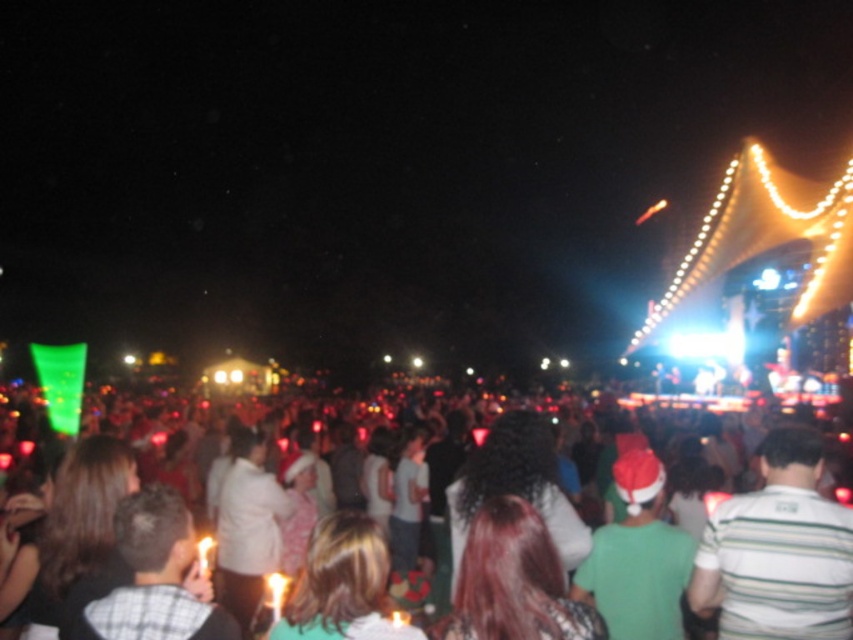
Question: Is white cotton shirt at center further to camera compared to striped cotton shirt at center?

Choices:
 (A) yes
 (B) no

Answer: (A)

Question: Which point is closer to the camera taking this photo?

Choices:
 (A) (440, 401)
 (B) (799, 460)

Answer: (B)

Question: Among these objects, which one is farthest from the camera?

Choices:
 (A) striped cotton shirt at center
 (B) white cotton shirt at center

Answer: (B)

Question: Does white cotton shirt at center appear on the right side of striped cotton shirt at center?

Choices:
 (A) yes
 (B) no

Answer: (B)

Question: Can you confirm if white cotton shirt at center is wider than striped cotton shirt at center?

Choices:
 (A) no
 (B) yes

Answer: (B)

Question: Which point is farther to the camera?

Choices:
 (A) (743, 515)
 (B) (13, 513)

Answer: (B)